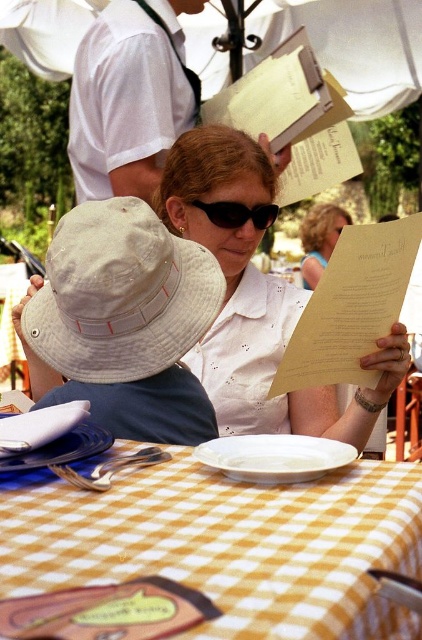
You are a customer sitting at the table and want to read the white paper menu at center. Where should you look relative to the white shirt at upper left?

The white paper menu at center is located below the white shirt at upper left, so you should look downward from the white shirt at upper left to find it.

You are sitting at the table and want to reach for the white paper menu at center. Which direction should you move your hand from the white shirt at upper left to get it?

The white paper menu at center is to the right of the white shirt at upper left, so you should move your hand to the right from the white shirt at upper left to reach it.

You are sitting at the table in the image and want to reach both the point at coordinates (x=238, y=284) and the point at coordinates (x=180, y=97). Which point will you reach first?

You will reach the point at coordinates (x=238, y=284) first because it is closer to you than the point at coordinates (x=180, y=97).